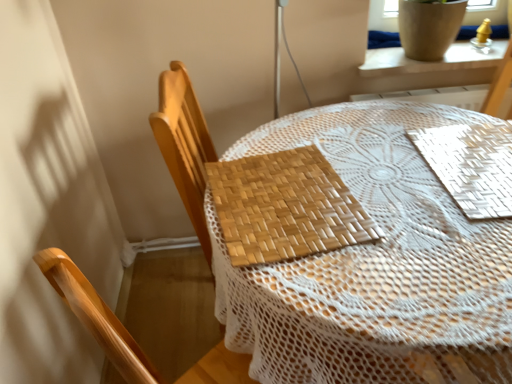
The image size is (512, 384). I want to click on free region under woven wood placemat at center, the 2th mat positioned from the right (from a real-world perspective), so click(x=283, y=188).